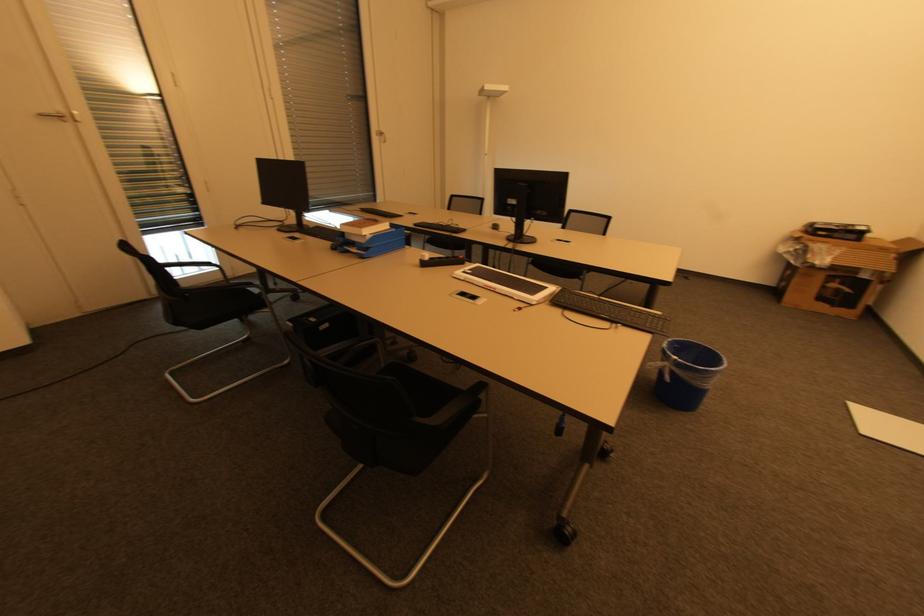
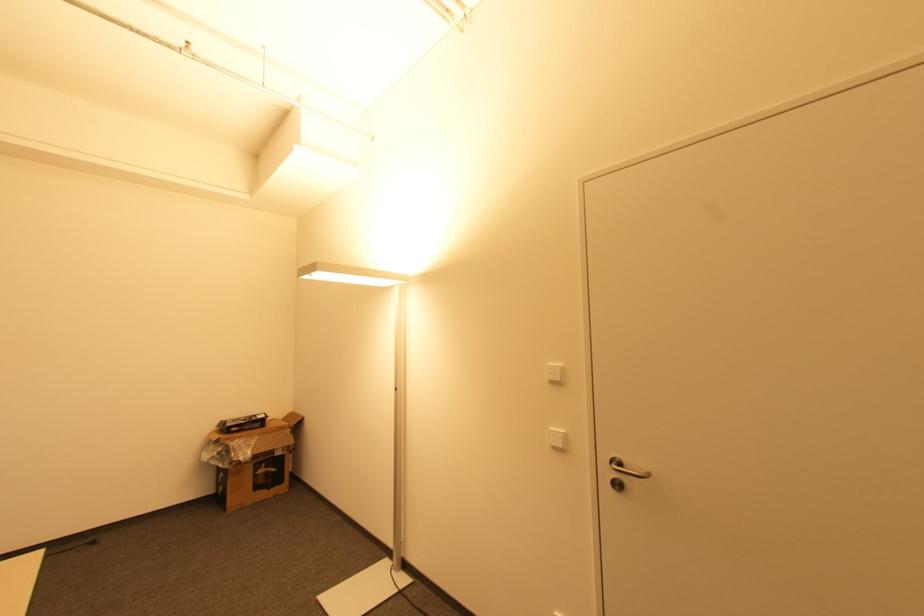
Question: The camera is either moving clockwise (left) or counter-clockwise (right) around the object. The first image is from the beginning of the video and the second image is from the end. Is the camera moving left or right when shooting the video?

Choices:
 (A) Left
 (B) Right

Answer: (A)